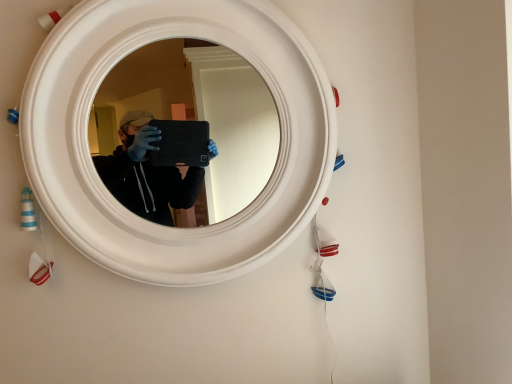
Identify the location of white matte mirror at center. Image resolution: width=512 pixels, height=384 pixels. (101, 181).

The image size is (512, 384). Describe the element at coordinates (101, 181) in the screenshot. I see `white matte mirror at center` at that location.

Find the location of a particular element. The image size is (512, 384). white matte mirror at center is located at coordinates (101, 181).